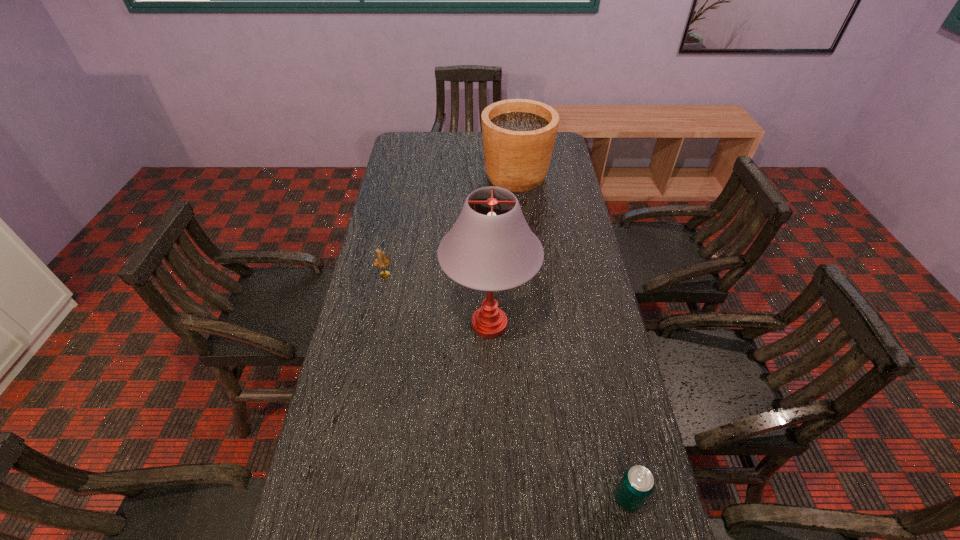
Locate an element on the screen. The width and height of the screenshot is (960, 540). the tallest object is located at coordinates (490, 248).

Identify the location of the third farthest object. (490, 248).

The width and height of the screenshot is (960, 540). What are the coordinates of `flowerpot` in the screenshot? It's located at (518, 134).

Locate an element on the screen. The width and height of the screenshot is (960, 540). the farthest object is located at coordinates (518, 134).

Where is `candle holder`? candle holder is located at coordinates (381, 261).

Locate an element on the screen. the second farthest object is located at coordinates (381, 261).

Where is `the nearest object`? the nearest object is located at coordinates (637, 483).

Where is `free spot located 0.280m on the front-facing side of the third farthest object`? The width and height of the screenshot is (960, 540). free spot located 0.280m on the front-facing side of the third farthest object is located at coordinates (492, 468).

The image size is (960, 540). I want to click on blank space located on the left of the flowerpot, so click(x=469, y=176).

Find the location of a particular element. This screenshot has height=540, width=960. free space located on the right of the candle holder is located at coordinates (449, 274).